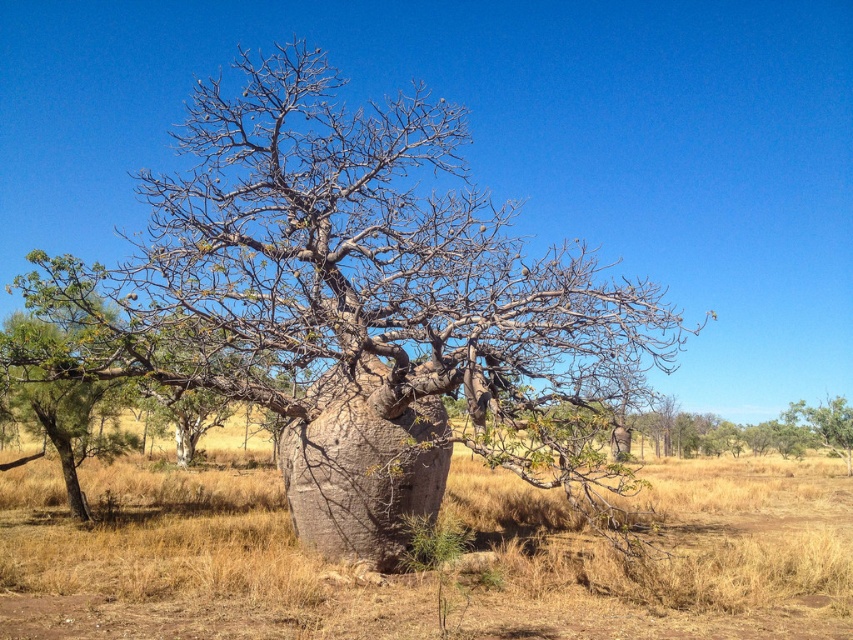
Question: Which of the following is the farthest from the observer?

Choices:
 (A) brown dry grass at center
 (B) gray textured tree at center

Answer: (B)

Question: From the image, what is the correct spatial relationship of gray textured tree at center in relation to brown dry grass at center?

Choices:
 (A) left
 (B) right

Answer: (B)

Question: Is the position of gray textured tree at center more distant than that of brown dry grass at center?

Choices:
 (A) no
 (B) yes

Answer: (B)

Question: Is gray textured tree at center positioned behind brown dry grass at center?

Choices:
 (A) yes
 (B) no

Answer: (A)

Question: Which point is farther to the camera?

Choices:
 (A) coord(32,467)
 (B) coord(381,102)

Answer: (B)